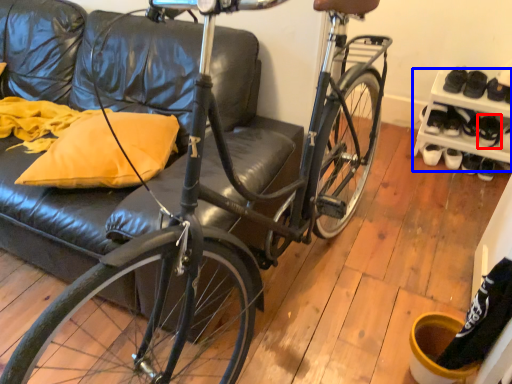
Question: Which point is closer to the camera, shoe (highlighted by a red box) or shelf (highlighted by a blue box)?

Choices:
 (A) shoe
 (B) shelf

Answer: (B)